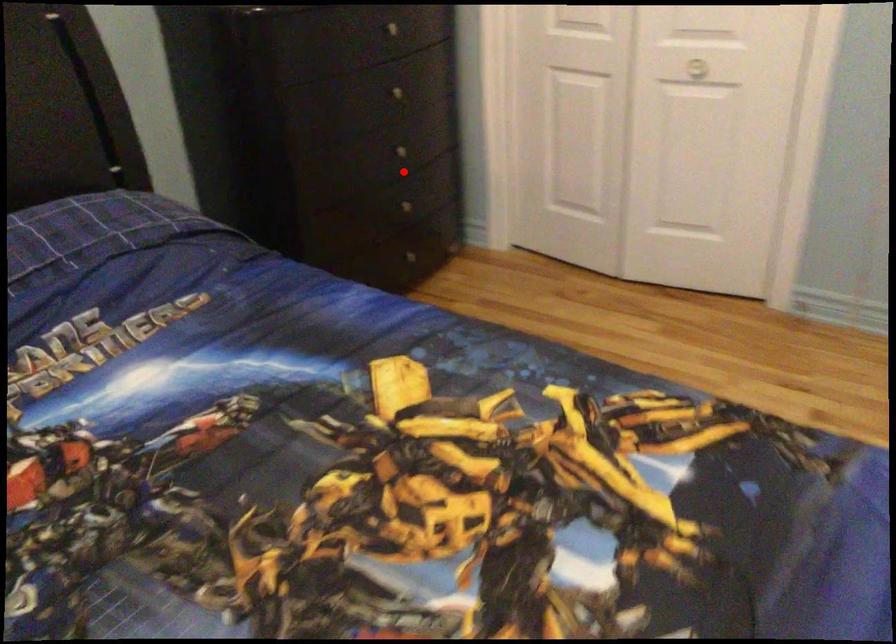
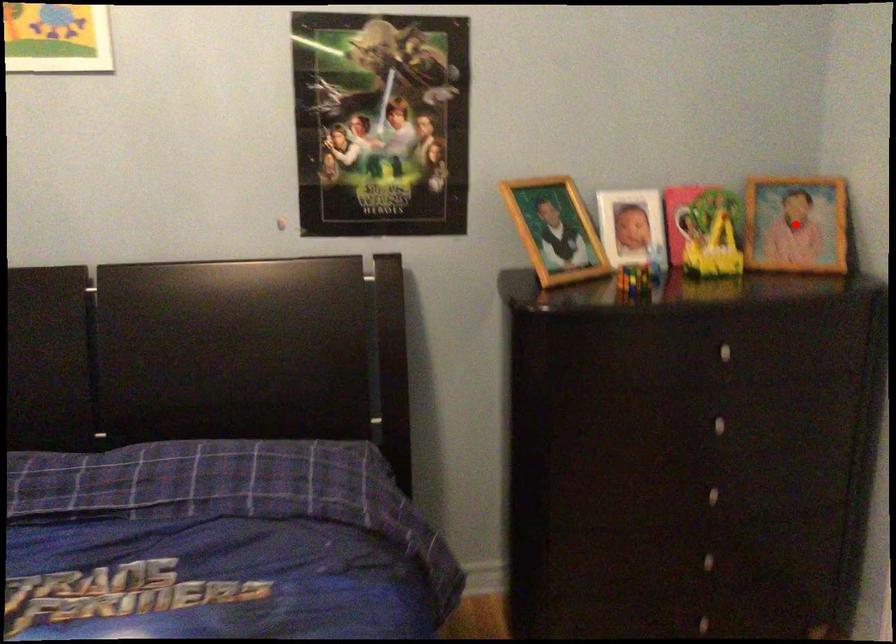
I am providing you with two images of the same scene from different viewpoints. A red point is marked on the first image and another point is marked on the second image. Is the red point in image1 aligned with the point shown in image2?

No